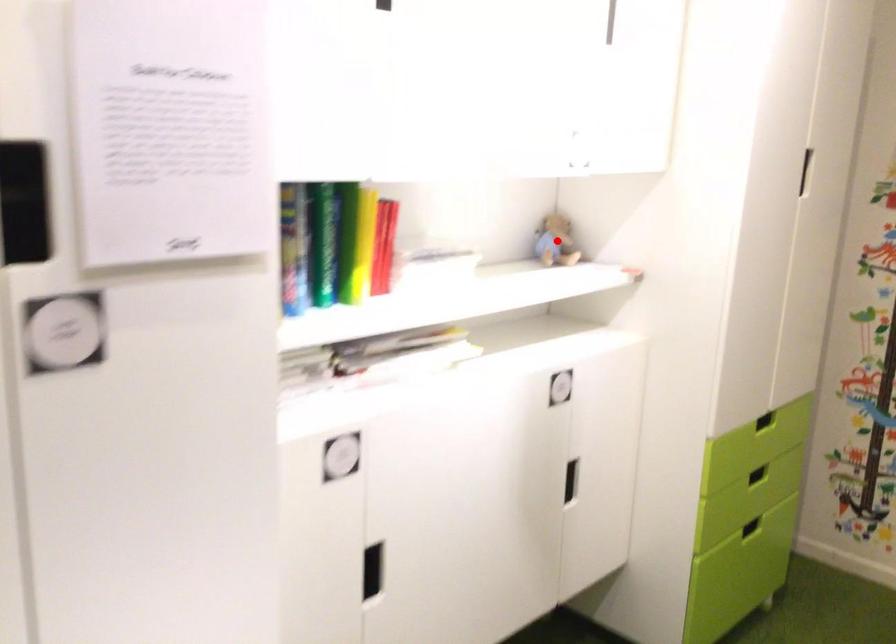
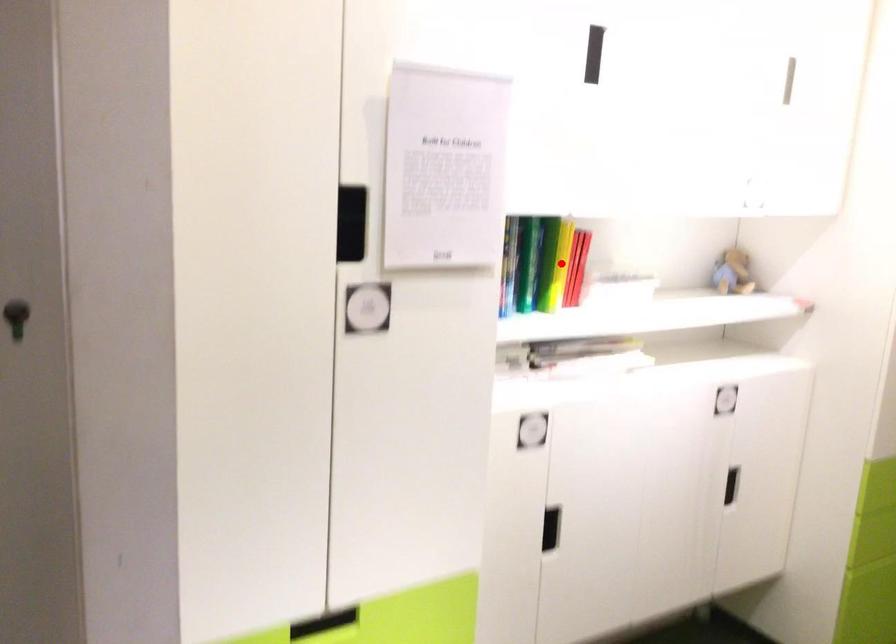
I am providing you with two images of the same scene from different viewpoints. A red point is marked on the first image and another point is marked on the second image. Are the points marked in image1 and image2 representing the same 3D position?

No